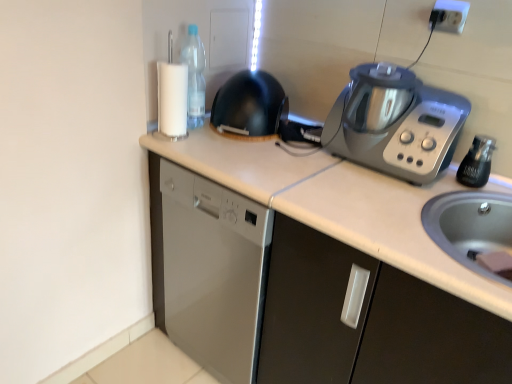
The image size is (512, 384). What are the coordinates of `free point in front of transparent plastic bottle at upper left, positioned as the 2th bottle in bottom-to-top order` in the screenshot? It's located at (193, 144).